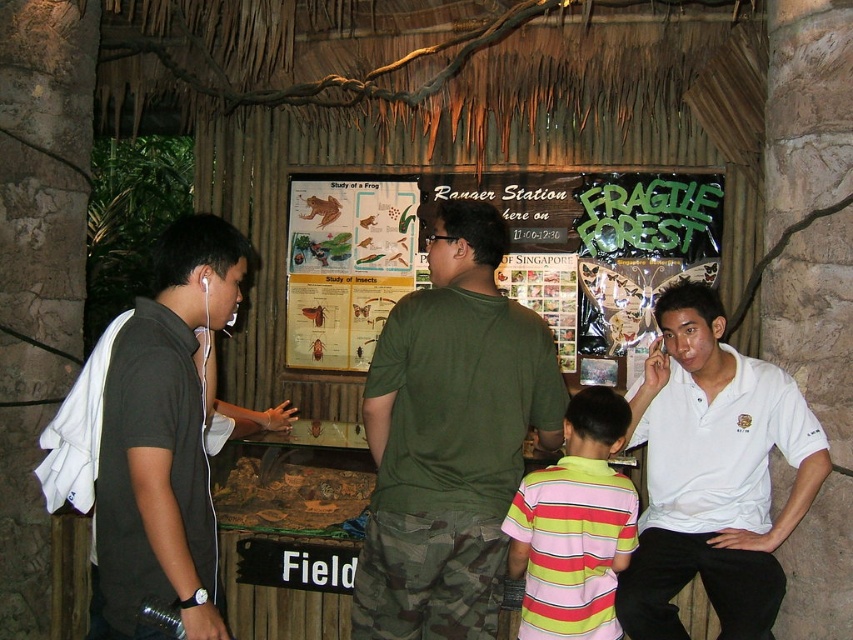
This screenshot has height=640, width=853. What are the coordinates of `green matte shirt at center` in the screenshot? It's located at (450, 436).

Measure the distance between green matte shirt at center and camera.

green matte shirt at center is 2.41 meters from camera.

This screenshot has width=853, height=640. In order to click on green matte shirt at center in this screenshot , I will do `click(450, 436)`.

Can you confirm if green matte shirt at center is positioned to the left of black matte shirt at left?

In fact, green matte shirt at center is to the right of black matte shirt at left.

Can you confirm if green matte shirt at center is smaller than black matte shirt at left?

No, green matte shirt at center is not smaller than black matte shirt at left.

Is point (543, 426) behind point (128, 432)?

Yes, point (543, 426) is farther from viewer.

Where is `green matte shirt at center`? This screenshot has height=640, width=853. green matte shirt at center is located at coordinates (450, 436).

Which is more to the right, white cotton polo shirt at right or striped cotton shirt at center?

From the viewer's perspective, white cotton polo shirt at right appears more on the right side.

Which is more to the left, white cotton polo shirt at right or striped cotton shirt at center?

striped cotton shirt at center

Between point (650, 600) and point (566, 616), which one is positioned in front?

Positioned in front is point (566, 616).

This screenshot has height=640, width=853. Identify the location of white cotton polo shirt at right. click(712, 474).